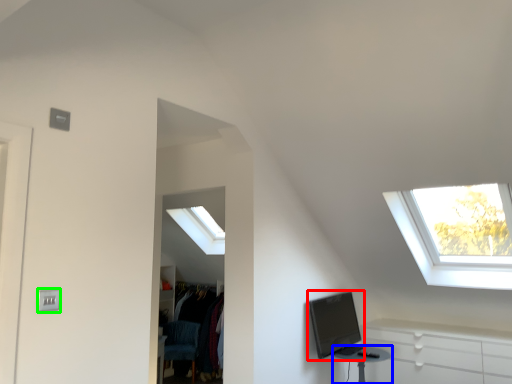
Question: Based on their relative distances, which object is nearer to computer monitor (highlighted by a red box)? Choose from table (highlighted by a blue box) and electric outlet (highlighted by a green box).

Choices:
 (A) table
 (B) electric outlet

Answer: (A)